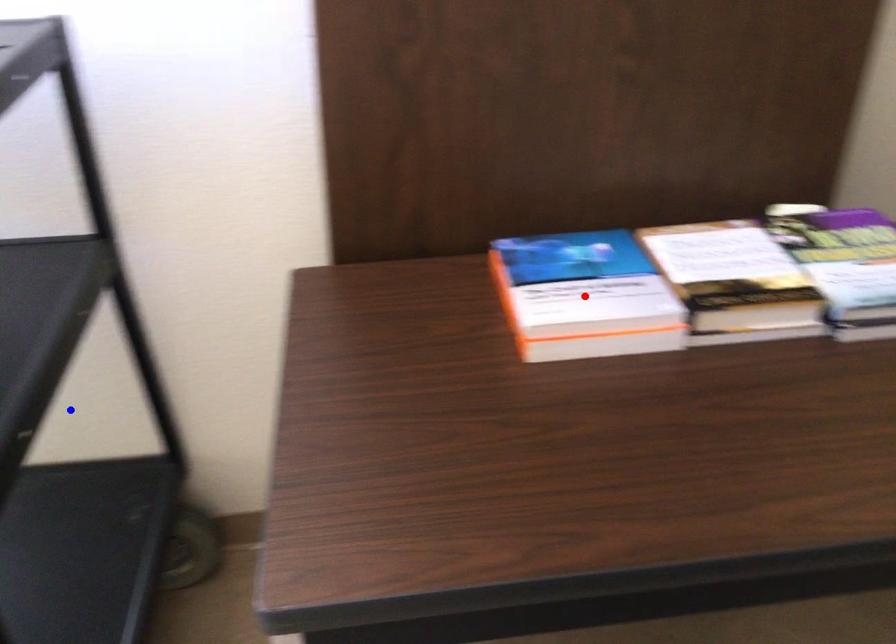
Question: Two points are marked on the image. Which point is closer to the camera?

Choices:
 (A) Blue point is closer.
 (B) Red point is closer.

Answer: (B)